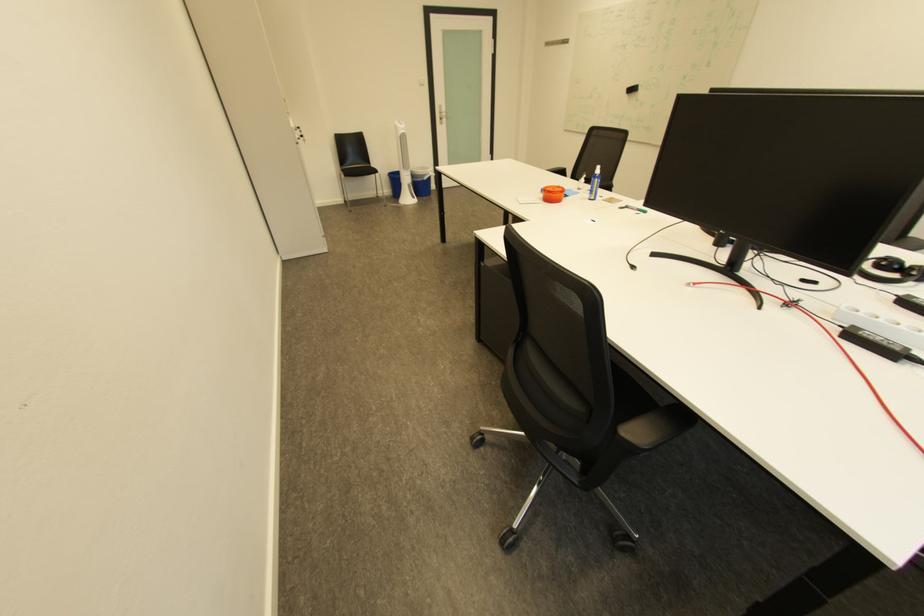
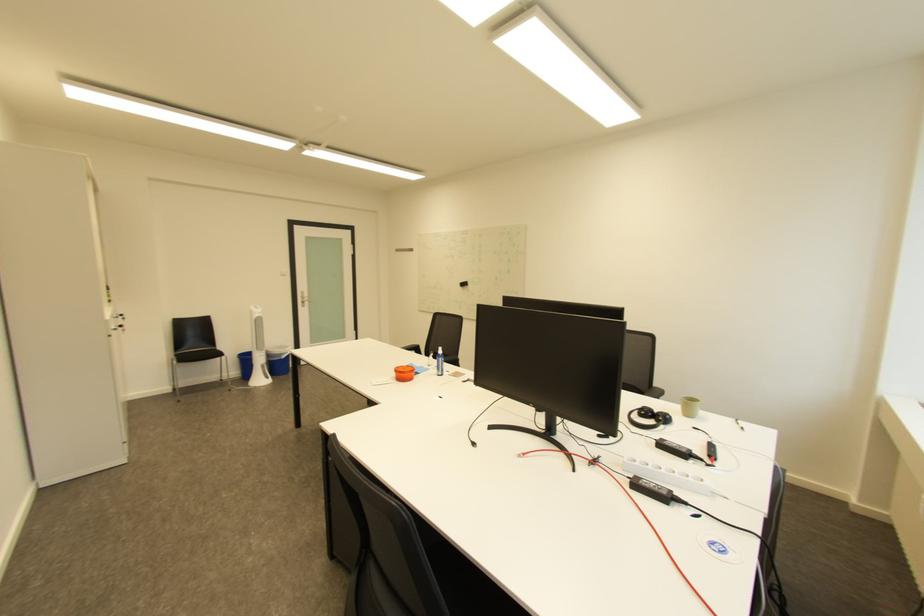
Where in the second image is the point corresponding to [419,187] from the first image?

(273, 367)